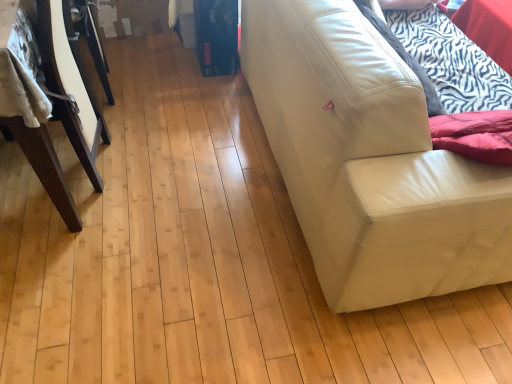
Question: From a real-world perspective, is white leather couch at right beneath dark brown wood table at left?

Choices:
 (A) yes
 (B) no

Answer: (A)

Question: Is white leather couch at right oriented towards dark brown wood table at left?

Choices:
 (A) no
 (B) yes

Answer: (A)

Question: Is white leather couch at right taller than dark brown wood table at left?

Choices:
 (A) yes
 (B) no

Answer: (A)

Question: From a real-world perspective, is white leather couch at right on top of dark brown wood table at left?

Choices:
 (A) no
 (B) yes

Answer: (A)

Question: From the image's perspective, is white leather couch at right on dark brown wood table at left?

Choices:
 (A) no
 (B) yes

Answer: (A)

Question: Can you confirm if white leather couch at right is positioned to the right of dark brown wood table at left?

Choices:
 (A) yes
 (B) no

Answer: (A)

Question: Would you say dark brown wood table at left is outside white leather couch at right?

Choices:
 (A) yes
 (B) no

Answer: (A)

Question: From the image's perspective, is dark brown wood table at left beneath white leather couch at right?

Choices:
 (A) yes
 (B) no

Answer: (B)

Question: Is dark brown wood table at left far from white leather couch at right?

Choices:
 (A) no
 (B) yes

Answer: (A)

Question: From a real-world perspective, is dark brown wood table at left positioned under white leather couch at right based on gravity?

Choices:
 (A) yes
 (B) no

Answer: (B)

Question: Is dark brown wood table at left wider than white leather couch at right?

Choices:
 (A) no
 (B) yes

Answer: (B)

Question: From the image's perspective, would you say dark brown wood table at left is positioned over white leather couch at right?

Choices:
 (A) no
 (B) yes

Answer: (B)

Question: From a real-world perspective, is dark brown wood table at left above or below white leather couch at right?

Choices:
 (A) below
 (B) above

Answer: (B)